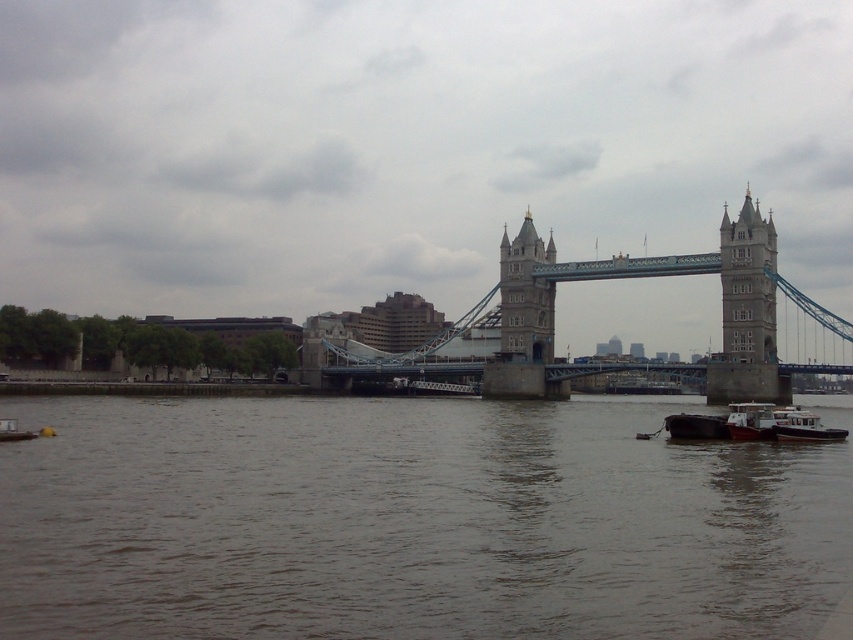
Question: Which of the following is the closest to the observer?

Choices:
 (A) white matte barge at lower right
 (B) stone stonework tower at center
 (C) brown water at lower center

Answer: (C)

Question: Which point appears closest to the camera in this image?

Choices:
 (A) (772, 301)
 (B) (532, 317)

Answer: (A)

Question: Does white matte barge at lower right appear on the left side of white plastic boat at lower right?

Choices:
 (A) no
 (B) yes

Answer: (B)

Question: Based on their relative distances, which object is nearer to the brown water at lower center?

Choices:
 (A) stone tower at center
 (B) stone gray suspension bridge at center
 (C) white matte barge at lower right
 (D) stone stonework tower at center

Answer: (C)

Question: Does brown water at lower center have a greater width compared to white matte barge at lower right?

Choices:
 (A) no
 (B) yes

Answer: (B)

Question: Does stone stonework tower at center appear over white matte barge at lower right?

Choices:
 (A) yes
 (B) no

Answer: (A)